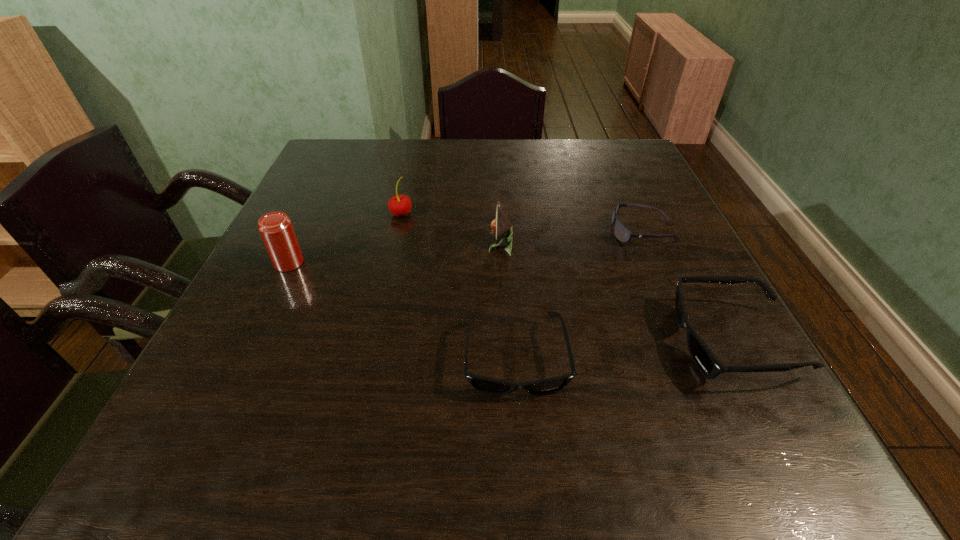
The image size is (960, 540). What are the coordinates of `the second shortest sunglasses` in the screenshot? It's located at [x=484, y=384].

The width and height of the screenshot is (960, 540). I want to click on the fifth tallest object, so click(x=484, y=384).

The width and height of the screenshot is (960, 540). I want to click on the fourth tallest object, so click(708, 364).

Find the location of a particular element. This screenshot has height=540, width=960. the second object from left to right is located at coordinates (400, 205).

Find the location of a particular element. The height and width of the screenshot is (540, 960). avocado is located at coordinates (501, 226).

Locate an element on the screen. the leftmost object is located at coordinates (276, 229).

Locate an element on the screen. This screenshot has width=960, height=540. the farthest sunglasses is located at coordinates (623, 234).

Image resolution: width=960 pixels, height=540 pixels. In order to click on the shortest sunglasses in this screenshot , I will do `click(623, 234)`.

Identify the location of vacant space situated on the front-facing side of the tallest sunglasses. (542, 342).

At what (x,y) coordinates should I click in order to perform the action: click on vacant point located 0.060m on the front-facing side of the tallest sunglasses. Please return your answer as a coordinate pair (x, y). The width and height of the screenshot is (960, 540). Looking at the image, I should click on (642, 342).